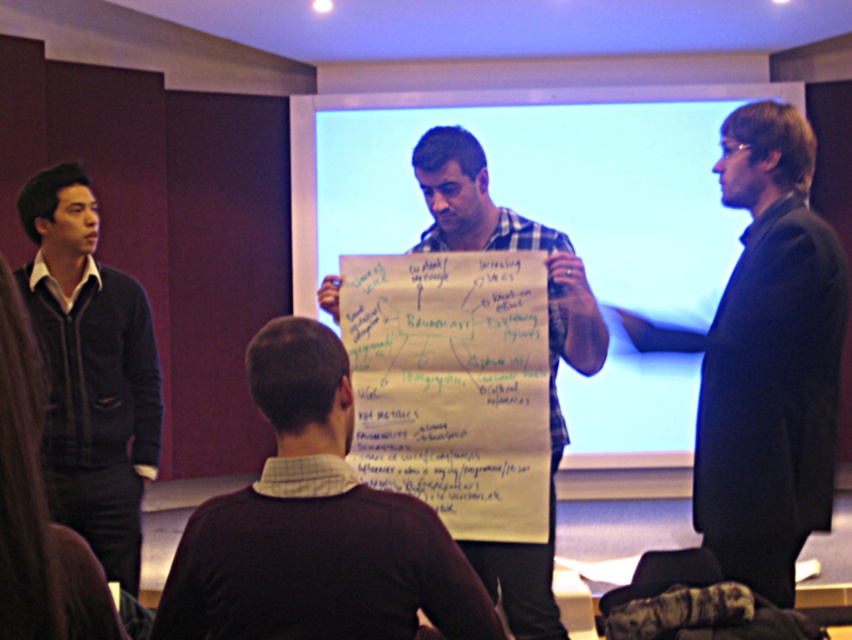
You are an attendee at this presentation. You notice the black smooth suit at right and the white paperboard at center. Which object is positioned higher in the image?

The black smooth suit at right is above the white paperboard at center, so it is positioned higher in the image.

You are attending a meeting and see two people wearing sweaters. One is wearing a dark brown sweater at center and another is wearing a velvet dark blue sweater at left. Which sweater is closer to you?

The dark brown sweater at center is closer to you than the velvet dark blue sweater at left.

You are standing in the room and want to hand a document to the person wearing the dark brown sweater at center. Based on their position, which direction should you move to reach them?

The dark brown sweater at center is located at point 0.823 on the horizontal axis and 0.371 on the vertical axis, so you should move towards the center of the room to reach them.